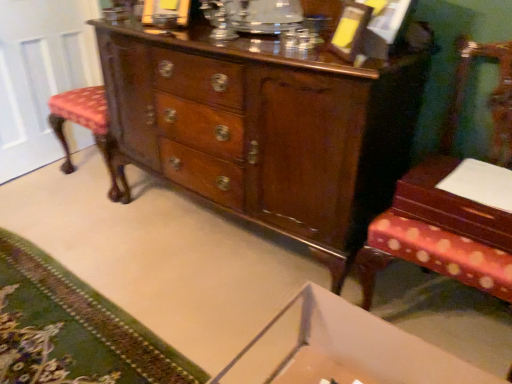
This screenshot has width=512, height=384. In order to click on vacant space to the left of shiny brown wood chest of drawers at center in this screenshot , I will do pos(97,233).